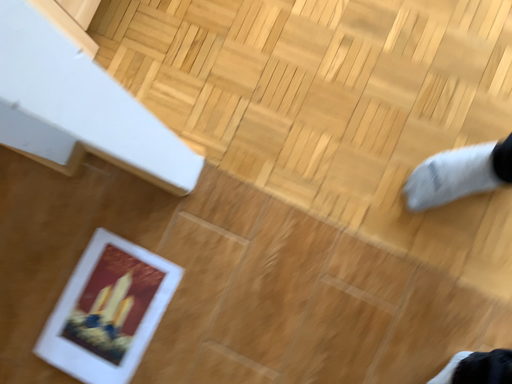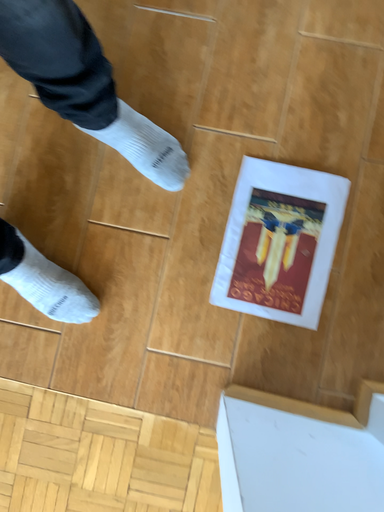
Question: How did the camera likely rotate when shooting the video?

Choices:
 (A) rotated upward
 (B) rotated downward

Answer: (A)